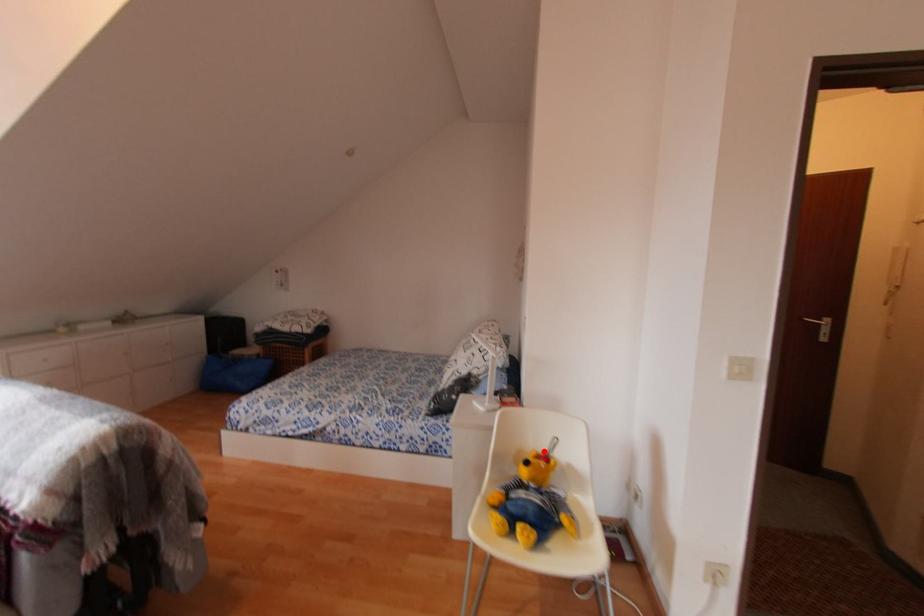
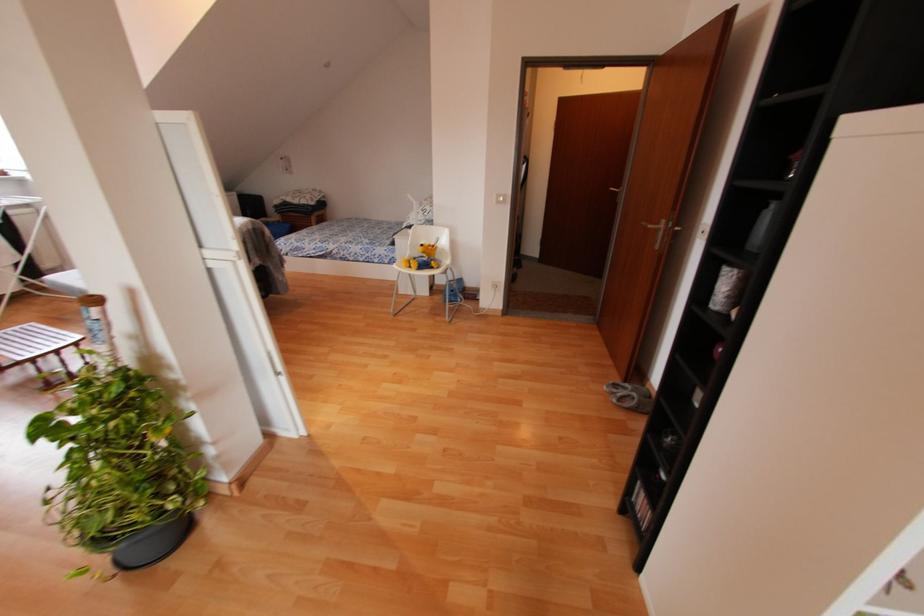
In the second image, find the point that corresponds to the highlighted location in the first image.

(432, 244)